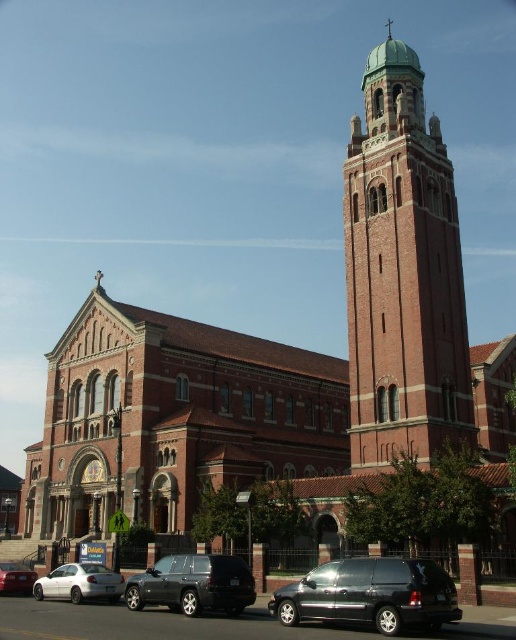
Measure the distance between green copper tower at upper center and camera.

A distance of 51.53 meters exists between green copper tower at upper center and camera.

Can you confirm if green copper tower at upper center is thinner than shiny black minivan at lower center?

Incorrect, green copper tower at upper center's width is not less than shiny black minivan at lower center's.

Between point (417, 228) and point (300, 596), which one is positioned in front?

Positioned in front is point (300, 596).

Where is `green copper tower at upper center`? green copper tower at upper center is located at coordinates (402, 273).

Is shiny black suv at lower left shorter than matte white sedan at lower left?

Incorrect, shiny black suv at lower left's height does not fall short of matte white sedan at lower left's.

Can you confirm if shiny black suv at lower left is positioned to the left of matte white sedan at lower left?

No, shiny black suv at lower left is not to the left of matte white sedan at lower left.

Which is behind, point (244, 592) or point (24, 564)?

Point (24, 564)

You are a GUI agent. You are given a task and a screenshot of the screen. Output one action in this format:
    pyautogui.click(x=<x>, y=<y>)
    Task: Click on the shiny black suv at lower left
    Image resolution: width=516 pixels, height=640 pixels.
    Given the screenshot: What is the action you would take?
    pyautogui.click(x=192, y=584)

Who is more distant from viewer, (x=409, y=573) or (x=154, y=586)?

Positioned behind is point (x=154, y=586).

Describe the element at coordinates (370, 595) in the screenshot. I see `shiny black minivan at lower center` at that location.

The image size is (516, 640). What are the coordinates of `shiny black minivan at lower center` in the screenshot? It's located at (370, 595).